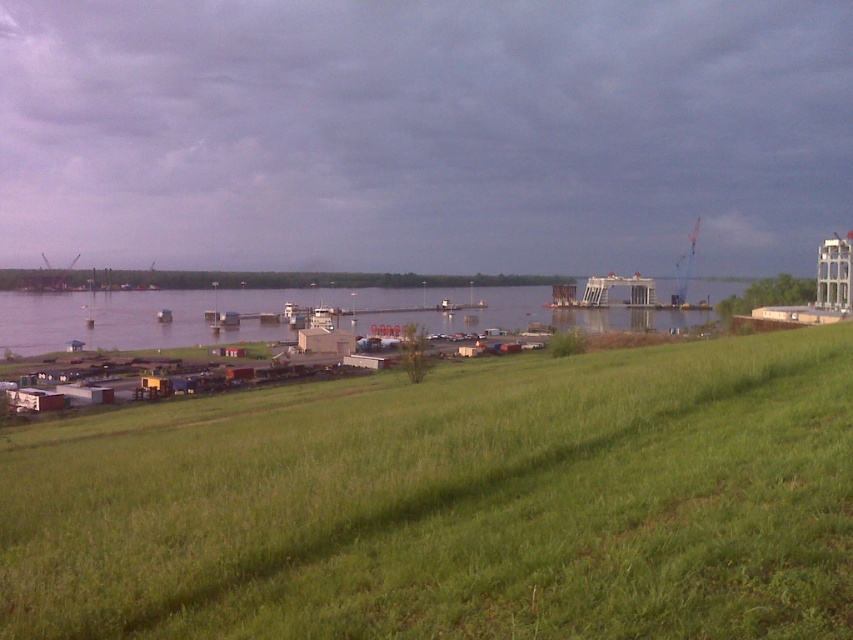
Question: Is green grassy hillside at lower center closer to the viewer compared to clear water at center?

Choices:
 (A) no
 (B) yes

Answer: (B)

Question: Does green grassy hillside at lower center have a lesser width compared to clear water at center?

Choices:
 (A) yes
 (B) no

Answer: (A)

Question: In this image, where is green grassy hillside at lower center located relative to clear water at center?

Choices:
 (A) right
 (B) left

Answer: (B)

Question: Which of the following is the farthest from the observer?

Choices:
 (A) clear water at center
 (B) green grassy hillside at lower center

Answer: (A)

Question: Which object appears closest to the camera in this image?

Choices:
 (A) green grassy hillside at lower center
 (B) clear water at center

Answer: (A)

Question: Which point is closer to the camera?

Choices:
 (A) (16, 333)
 (B) (555, 397)

Answer: (B)